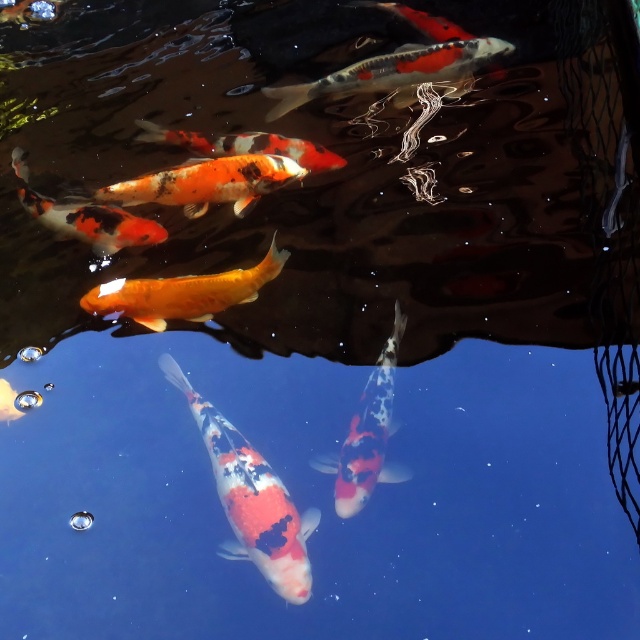
Is orange glossy goldfish at center in front of orange and white speckled fish at left?

Yes, it is.

Between point (84, 301) and point (115, 220), which one is positioned in front?

Positioned in front is point (84, 301).

Image resolution: width=640 pixels, height=640 pixels. Describe the element at coordinates (182, 292) in the screenshot. I see `orange glossy goldfish at center` at that location.

The image size is (640, 640). I want to click on orange glossy goldfish at center, so click(x=182, y=292).

Based on the photo, how distant is orange and white speckled fish at left from shiny orange and white fish at center?

They are 13.07 inches apart.

Where is `orange and white speckled fish at left`? orange and white speckled fish at left is located at coordinates (86, 218).

I want to click on orange and white speckled fish at left, so click(86, 218).

What do you see at coordinates (396, 74) in the screenshot? This screenshot has width=640, height=640. I see `speckled orange fish at upper center` at bounding box center [396, 74].

Is speckled orange fish at upper center closer to camera compared to speckled orange fish at center?

No, speckled orange fish at upper center is further to the viewer.

Who is more forward, (486, 64) or (378, 460)?

Point (378, 460) is in front.

Where is `speckled orange fish at upper center`? Image resolution: width=640 pixels, height=640 pixels. speckled orange fish at upper center is located at coordinates (396, 74).